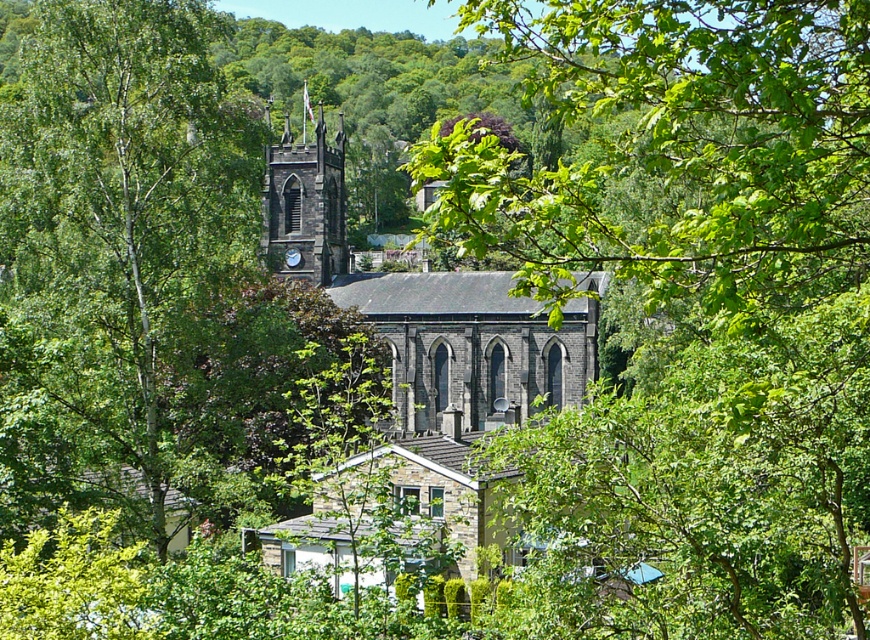
Question: Can you confirm if green leafy tree at center is positioned below dark gray stone clock tower at center?

Choices:
 (A) no
 (B) yes

Answer: (A)

Question: Is green leafy tree at center further to camera compared to dark gray stone clock tower at center?

Choices:
 (A) yes
 (B) no

Answer: (B)

Question: Does green leafy tree at center appear over dark gray stone clock tower at center?

Choices:
 (A) yes
 (B) no

Answer: (A)

Question: Which point is closer to the camera?

Choices:
 (A) (270, 257)
 (B) (224, 208)

Answer: (B)